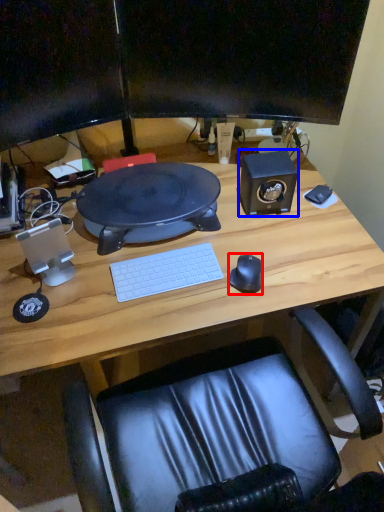
Question: Which object appears closest to the camera in this image, mouse (highlighted by a red box) or speaker (highlighted by a blue box)?

Choices:
 (A) mouse
 (B) speaker

Answer: (A)